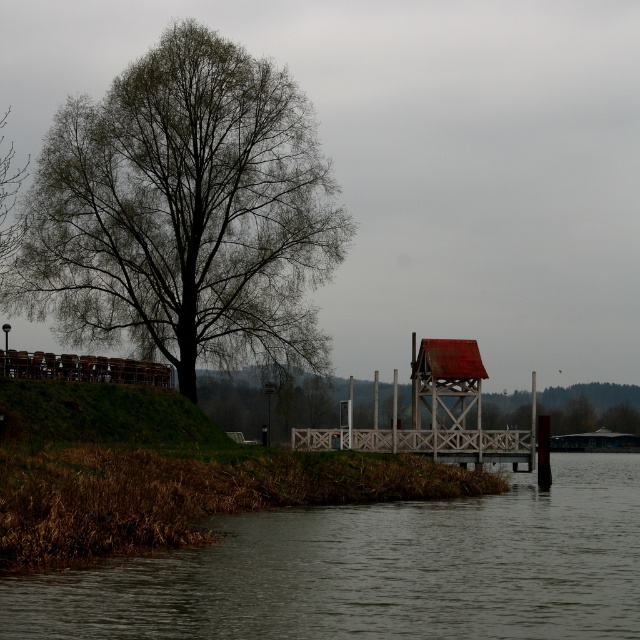
Can you confirm if green leafy tree at left is positioned below brown matte river at lower left?

No, green leafy tree at left is not below brown matte river at lower left.

Is green leafy tree at left thinner than brown matte river at lower left?

Correct, green leafy tree at left's width is less than brown matte river at lower left's.

Is point (188, 188) closer to viewer compared to point (452, 620)?

No.

The height and width of the screenshot is (640, 640). I want to click on green leafy tree at left, so click(x=182, y=212).